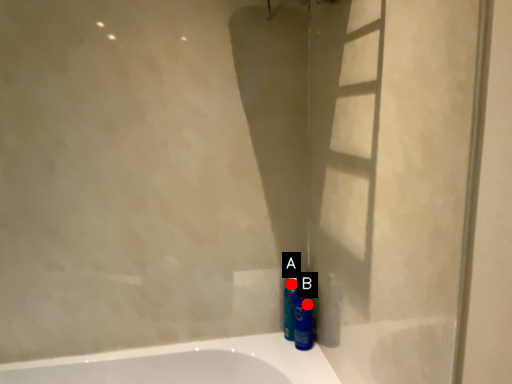
Question: Two points are circled on the image, labeled by A and B beside each circle. Which point appears farthest from the camera in this image?

Choices:
 (A) A is further
 (B) B is further

Answer: (A)